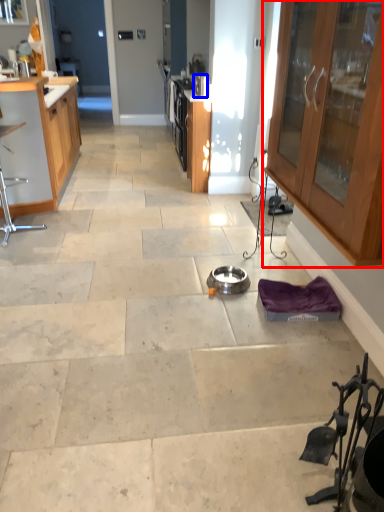
Question: Among these objects, which one is nearest to the camera, cabinetry (highlighted by a red box) or appliance (highlighted by a blue box)?

Choices:
 (A) cabinetry
 (B) appliance

Answer: (A)